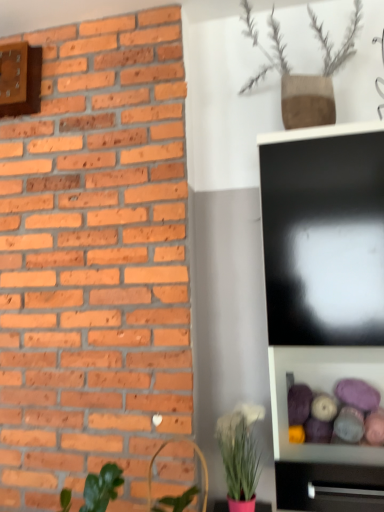
You are a GUI agent. You are given a task and a screenshot of the screen. Output one action in this format:
    pyautogui.click(x=<x>, y=<y>)
    Task: Click on the black glossy tv cabinet at lower right
    The image size is (384, 512).
    Given the screenshot: What is the action you would take?
    pyautogui.click(x=328, y=487)

At what (x,y) coordinates should I click in order to perform the action: click on matte pink pot at lower center, which ranks as the first houseplant in bottom-to-top order. Please return your answer as a coordinate pair (x, y). The image size is (384, 512). Looking at the image, I should click on (240, 455).

What do you see at coordinates (20, 79) in the screenshot? I see `wooden clock at upper left` at bounding box center [20, 79].

What do you see at coordinates (303, 75) in the screenshot? This screenshot has width=384, height=512. I see `brown textured vase at upper center, which is the 2th houseplant from bottom to top` at bounding box center [303, 75].

Find the location of `brown textured vase at upper center, which is counted as the 1th houseplant, starting from the top`. brown textured vase at upper center, which is counted as the 1th houseplant, starting from the top is located at coordinates (303, 75).

Identify the location of black glossy tv cabinet at lower right. (328, 487).

Which object is further away from the camera taking this photo, wooden clock at upper left or brown textured vase at upper center, which is the 2th houseplant from bottom to top?

wooden clock at upper left is more distant.

Considering the positions of objects wooden clock at upper left and brown textured vase at upper center, which is the 2th houseplant from bottom to top, in the image provided, who is more to the left, wooden clock at upper left or brown textured vase at upper center, which is the 2th houseplant from bottom to top,?

From the viewer's perspective, wooden clock at upper left appears more on the left side.

Can you confirm if wooden clock at upper left is bigger than brown textured vase at upper center, which is counted as the 1th houseplant, starting from the top?

No.

Based on the photo, which is further, (27, 48) or (310, 121)?

The point (27, 48) is behind.

Based on the photo, is matte pink pot at lower center, marked as the 2th houseplant in a top-to-bottom arrangement, at the left side of wooden clock at upper left?

Incorrect, matte pink pot at lower center, marked as the 2th houseplant in a top-to-bottom arrangement, is not on the left side of wooden clock at upper left.

Which object is closer to the camera taking this photo, matte pink pot at lower center, marked as the 2th houseplant in a top-to-bottom arrangement, or wooden clock at upper left?

matte pink pot at lower center, marked as the 2th houseplant in a top-to-bottom arrangement, is more forward.

From a real-world perspective, is matte pink pot at lower center, marked as the 2th houseplant in a top-to-bottom arrangement, located beneath wooden clock at upper left?

Correct, in the physical world, matte pink pot at lower center, marked as the 2th houseplant in a top-to-bottom arrangement, is lower than wooden clock at upper left.

Considering the sizes of objects black glossy tv cabinet at lower right and brown textured vase at upper center, which is the 2th houseplant from bottom to top, in the image provided, who is bigger, black glossy tv cabinet at lower right or brown textured vase at upper center, which is the 2th houseplant from bottom to top,?

Bigger between the two is brown textured vase at upper center, which is the 2th houseplant from bottom to top.

Which of these two, black glossy tv cabinet at lower right or brown textured vase at upper center, which is counted as the 1th houseplant, starting from the top, stands taller?

brown textured vase at upper center, which is counted as the 1th houseplant, starting from the top.

Could you measure the distance between black glossy tv cabinet at lower right and brown textured vase at upper center, which is the 2th houseplant from bottom to top?

They are 1.29 meters apart.

How different are the orientations of black glossy tv cabinet at lower right and brown textured vase at upper center, which is counted as the 1th houseplant, starting from the top, in degrees?

black glossy tv cabinet at lower right and brown textured vase at upper center, which is counted as the 1th houseplant, starting from the top, are facing 19.5 degrees away from each other.

Can you tell me how much wooden clock at upper left and black glossy tv cabinet at lower right differ in facing direction?

1.32 degrees.

From the image's perspective, is wooden clock at upper left beneath black glossy tv cabinet at lower right?

No.

Between wooden clock at upper left and black glossy tv cabinet at lower right, which one is positioned behind?

wooden clock at upper left is further from the camera.

Considering the points (37, 75) and (344, 487), which point is in front, point (37, 75) or point (344, 487)?

Positioned in front is point (344, 487).

In the scene shown: Who is smaller, brown textured vase at upper center, which is the 2th houseplant from bottom to top, or wooden clock at upper left?

Smaller between the two is wooden clock at upper left.

What are the coordinates of `clock that appears above the brown textured vase at upper center, which is counted as the 1th houseplant, starting from the top (from the image's perspective)` in the screenshot? It's located at (20, 79).

Is wooden clock at upper left located within brown textured vase at upper center, which is the 2th houseplant from bottom to top?

No, wooden clock at upper left is not surrounded by brown textured vase at upper center, which is the 2th houseplant from bottom to top.

What's the angular difference between brown textured vase at upper center, which is the 2th houseplant from bottom to top, and matte pink pot at lower center, marked as the 2th houseplant in a top-to-bottom arrangement,'s facing directions?

brown textured vase at upper center, which is the 2th houseplant from bottom to top, and matte pink pot at lower center, marked as the 2th houseplant in a top-to-bottom arrangement, are facing 18 degrees away from each other.

Between brown textured vase at upper center, which is counted as the 1th houseplant, starting from the top, and matte pink pot at lower center, which ranks as the first houseplant in bottom-to-top order, which one has smaller width?

Thinner between the two is brown textured vase at upper center, which is counted as the 1th houseplant, starting from the top.

From the image's perspective, is brown textured vase at upper center, which is the 2th houseplant from bottom to top, below matte pink pot at lower center, marked as the 2th houseplant in a top-to-bottom arrangement?

No, from the image's perspective, brown textured vase at upper center, which is the 2th houseplant from bottom to top, is not beneath matte pink pot at lower center, marked as the 2th houseplant in a top-to-bottom arrangement.

Is brown textured vase at upper center, which is the 2th houseplant from bottom to top, directly adjacent to matte pink pot at lower center, marked as the 2th houseplant in a top-to-bottom arrangement?

No, brown textured vase at upper center, which is the 2th houseplant from bottom to top, is not next to matte pink pot at lower center, marked as the 2th houseplant in a top-to-bottom arrangement.

Does black glossy tv cabinet at lower right touch matte pink pot at lower center, marked as the 2th houseplant in a top-to-bottom arrangement?

No, black glossy tv cabinet at lower right is not in contact with matte pink pot at lower center, marked as the 2th houseplant in a top-to-bottom arrangement.

Which is behind, point (287, 502) or point (255, 447)?

The point (255, 447) is farther from the camera.

Is black glossy tv cabinet at lower right taller or shorter than matte pink pot at lower center, marked as the 2th houseplant in a top-to-bottom arrangement?

Clearly, black glossy tv cabinet at lower right is shorter compared to matte pink pot at lower center, marked as the 2th houseplant in a top-to-bottom arrangement.

How far apart are black glossy tv cabinet at lower right and matte pink pot at lower center, marked as the 2th houseplant in a top-to-bottom arrangement?

black glossy tv cabinet at lower right and matte pink pot at lower center, marked as the 2th houseplant in a top-to-bottom arrangement, are 8.89 inches apart from each other.

Locate an element on the screen. The height and width of the screenshot is (512, 384). clock on the left of brown textured vase at upper center, which is the 2th houseplant from bottom to top is located at coordinates (20, 79).

This screenshot has height=512, width=384. Identify the location of clock that appears above the matte pink pot at lower center, marked as the 2th houseplant in a top-to-bottom arrangement (from a real-world perspective). (20, 79).

Considering their positions, is wooden clock at upper left positioned further to matte pink pot at lower center, which ranks as the first houseplant in bottom-to-top order, than brown textured vase at upper center, which is counted as the 1th houseplant, starting from the top?

Among the two, wooden clock at upper left is located further to matte pink pot at lower center, which ranks as the first houseplant in bottom-to-top order.

Based on their spatial positions, is brown textured vase at upper center, which is the 2th houseplant from bottom to top, or wooden clock at upper left further from matte pink pot at lower center, which ranks as the first houseplant in bottom-to-top order?

wooden clock at upper left is positioned further to the anchor matte pink pot at lower center, which ranks as the first houseplant in bottom-to-top order.

Looking at the image, which one is located closer to brown textured vase at upper center, which is the 2th houseplant from bottom to top, wooden clock at upper left or black glossy tv cabinet at lower right?

wooden clock at upper left is closer to brown textured vase at upper center, which is the 2th houseplant from bottom to top.

Based on their spatial positions, is matte pink pot at lower center, marked as the 2th houseplant in a top-to-bottom arrangement, or brown textured vase at upper center, which is counted as the 1th houseplant, starting from the top, further from black glossy tv cabinet at lower right?

brown textured vase at upper center, which is counted as the 1th houseplant, starting from the top, is positioned further to the anchor black glossy tv cabinet at lower right.

Consider the image. Which object lies further to the anchor point matte pink pot at lower center, which ranks as the first houseplant in bottom-to-top order, brown textured vase at upper center, which is the 2th houseplant from bottom to top, or black glossy tv cabinet at lower right?

brown textured vase at upper center, which is the 2th houseplant from bottom to top.

Considering their positions, is wooden clock at upper left positioned closer to matte pink pot at lower center, marked as the 2th houseplant in a top-to-bottom arrangement, than black glossy tv cabinet at lower right?

black glossy tv cabinet at lower right is closer to matte pink pot at lower center, marked as the 2th houseplant in a top-to-bottom arrangement.

Which object lies further to the anchor point black glossy tv cabinet at lower right, brown textured vase at upper center, which is the 2th houseplant from bottom to top, or matte pink pot at lower center, which ranks as the first houseplant in bottom-to-top order?

brown textured vase at upper center, which is the 2th houseplant from bottom to top, is positioned further to the anchor black glossy tv cabinet at lower right.

Which object lies further to the anchor point wooden clock at upper left, brown textured vase at upper center, which is counted as the 1th houseplant, starting from the top, or matte pink pot at lower center, which ranks as the first houseplant in bottom-to-top order?

matte pink pot at lower center, which ranks as the first houseplant in bottom-to-top order, lies further to wooden clock at upper left than the other object.

Where is `houseplant between wooden clock at upper left and matte pink pot at lower center, marked as the 2th houseplant in a top-to-bottom arrangement, in the vertical direction`? The image size is (384, 512). houseplant between wooden clock at upper left and matte pink pot at lower center, marked as the 2th houseplant in a top-to-bottom arrangement, in the vertical direction is located at coordinates (303, 75).

The width and height of the screenshot is (384, 512). What are the coordinates of `houseplant between wooden clock at upper left and black glossy tv cabinet at lower right in the up-down direction` in the screenshot? It's located at (303, 75).

The width and height of the screenshot is (384, 512). I want to click on tv cabinet between brown textured vase at upper center, which is counted as the 1th houseplant, starting from the top, and matte pink pot at lower center, which ranks as the first houseplant in bottom-to-top order, in the vertical direction, so click(328, 487).

Identify the location of tv cabinet between wooden clock at upper left and matte pink pot at lower center, marked as the 2th houseplant in a top-to-bottom arrangement, vertically. This screenshot has width=384, height=512. (328, 487).